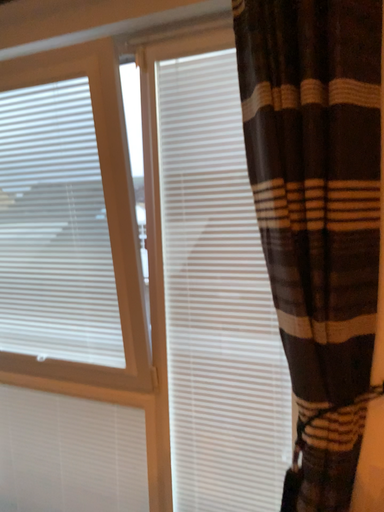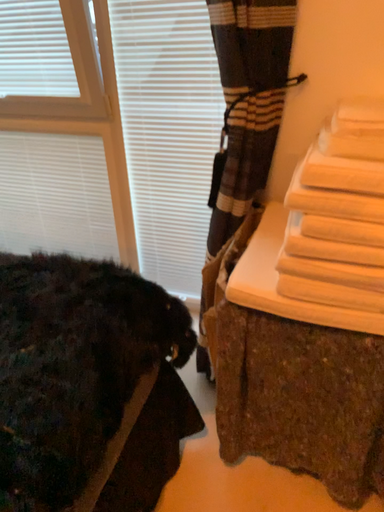
Question: Which way did the camera rotate in the video?

Choices:
 (A) rotated upward
 (B) rotated downward

Answer: (B)